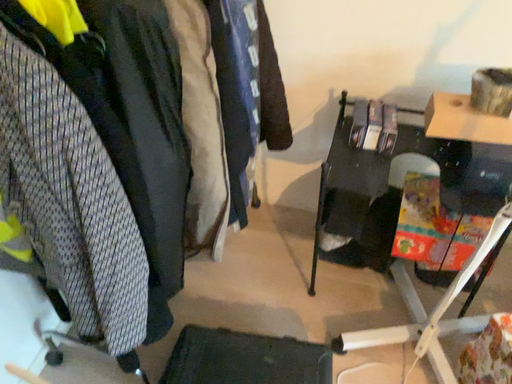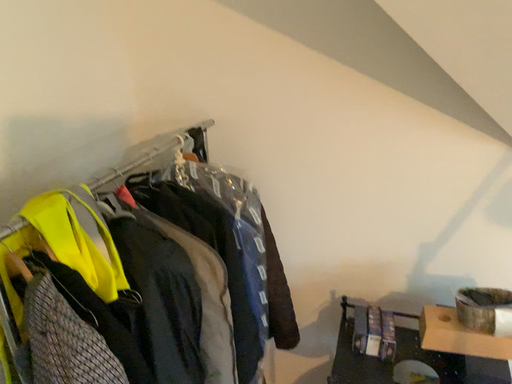
Question: How did the camera likely rotate when shooting the video?

Choices:
 (A) rotated downward
 (B) rotated upward

Answer: (B)